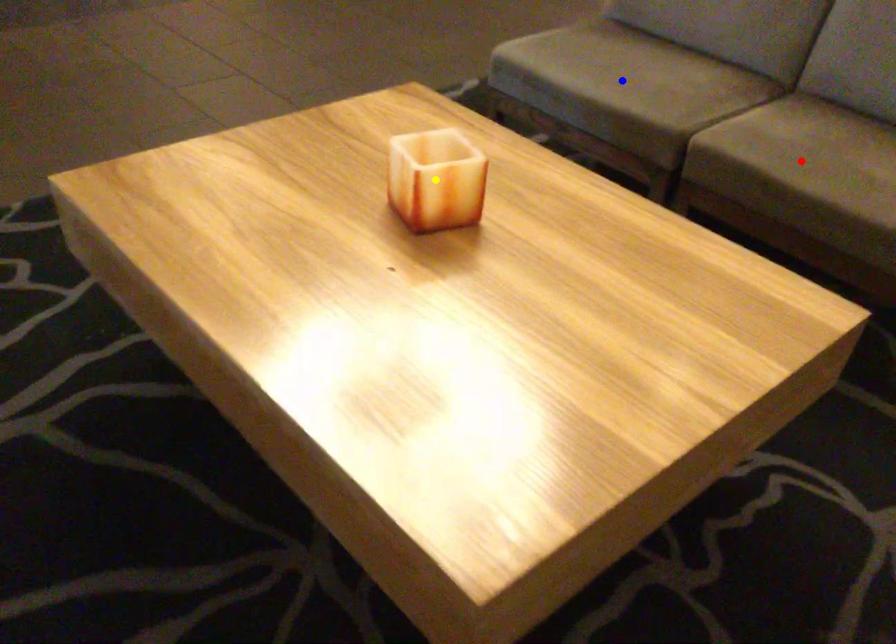
Order these from nearest to farthest:
A) red point
B) yellow point
C) blue point

blue point → red point → yellow point